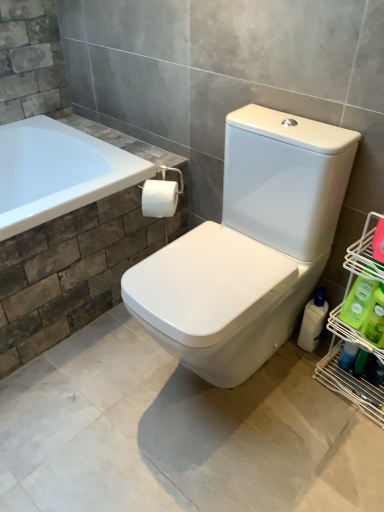
Question: Choose the correct answer: Is white matte toilet paper at center inside white glossy bottle at lower right, which is counted as the third cleaning product, starting from the front, or outside it?

Choices:
 (A) inside
 (B) outside

Answer: (B)

Question: In terms of height, does white matte toilet paper at center look taller or shorter compared to white glossy bottle at lower right, marked as the 1th cleaning product in a back-to-front arrangement?

Choices:
 (A) short
 (B) tall

Answer: (A)

Question: Which object is positioned farthest from the white matte toilet paper at center?

Choices:
 (A) green plastic bottle at right, which is the second cleaning product from front to back
 (B) green plastic bottle at lower right, placed as the first cleaning product when sorted from front to back
 (C) white glossy bottle at lower right, which is counted as the third cleaning product, starting from the front

Answer: (B)

Question: Which object is positioned closest to the green plastic bottle at right, which is the second cleaning product from front to back?

Choices:
 (A) white glossy bottle at lower right, marked as the 1th cleaning product in a back-to-front arrangement
 (B) green plastic bottle at lower right, which is counted as the third cleaning product, starting from the back
 (C) white matte toilet paper at center

Answer: (B)